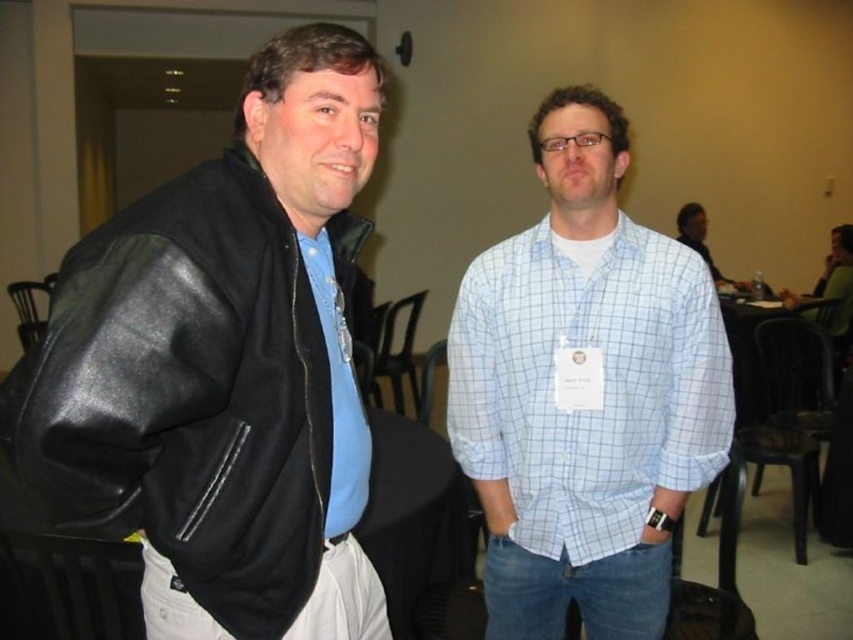
Question: Which point is farther to the camera?

Choices:
 (A) (578, 371)
 (B) (234, 163)

Answer: (A)

Question: Is black leather jacket at left to the left of light blue checkered shirt at center from the viewer's perspective?

Choices:
 (A) no
 (B) yes

Answer: (B)

Question: Does black leather jacket at left appear over light blue checkered shirt at center?

Choices:
 (A) yes
 (B) no

Answer: (A)

Question: Is black leather jacket at left wider than light blue checkered shirt at center?

Choices:
 (A) no
 (B) yes

Answer: (A)